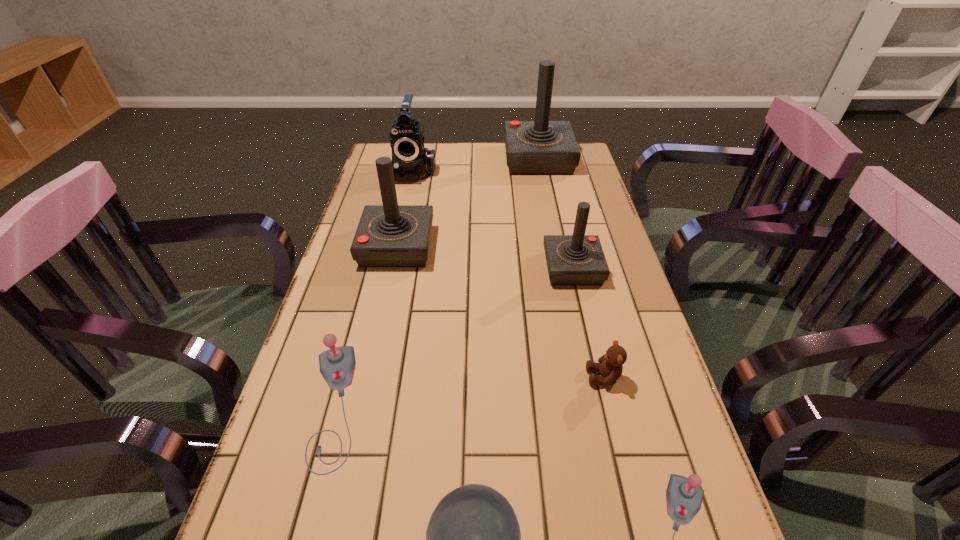
At what (x,y) coordinates should I click in order to perform the action: click on joystick situated at the far edge. Please return your answer as a coordinate pair (x, y). The width and height of the screenshot is (960, 540). Looking at the image, I should click on 541,147.

Identify the location of camcorder located at the far edge. This screenshot has height=540, width=960. (411, 161).

Where is `camcorder present at the left edge`? Image resolution: width=960 pixels, height=540 pixels. camcorder present at the left edge is located at coordinates (411, 161).

This screenshot has width=960, height=540. In order to click on teddy bear that is at the right edge in this screenshot , I will do `click(610, 366)`.

Where is `object that is at the far left corner`? Image resolution: width=960 pixels, height=540 pixels. object that is at the far left corner is located at coordinates (411, 161).

In order to click on object that is positioned at the far right corner in this screenshot , I will do `click(541, 147)`.

The width and height of the screenshot is (960, 540). I want to click on vacant space at the far edge of the desktop, so click(493, 154).

I want to click on free location at the left edge, so click(x=291, y=531).

In the image, there is a desktop. Identify the location of vacant space at the right edge. (557, 220).

This screenshot has width=960, height=540. What are the coordinates of `free space at the far right corner of the desktop` in the screenshot? It's located at (581, 164).